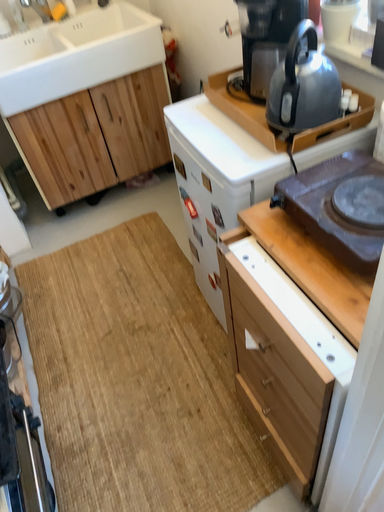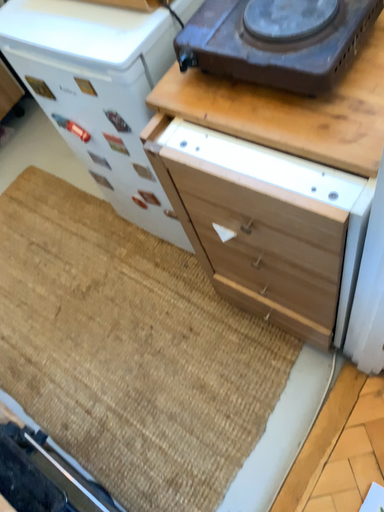
Question: How did the camera likely rotate when shooting the video?

Choices:
 (A) rotated left
 (B) rotated right

Answer: (B)